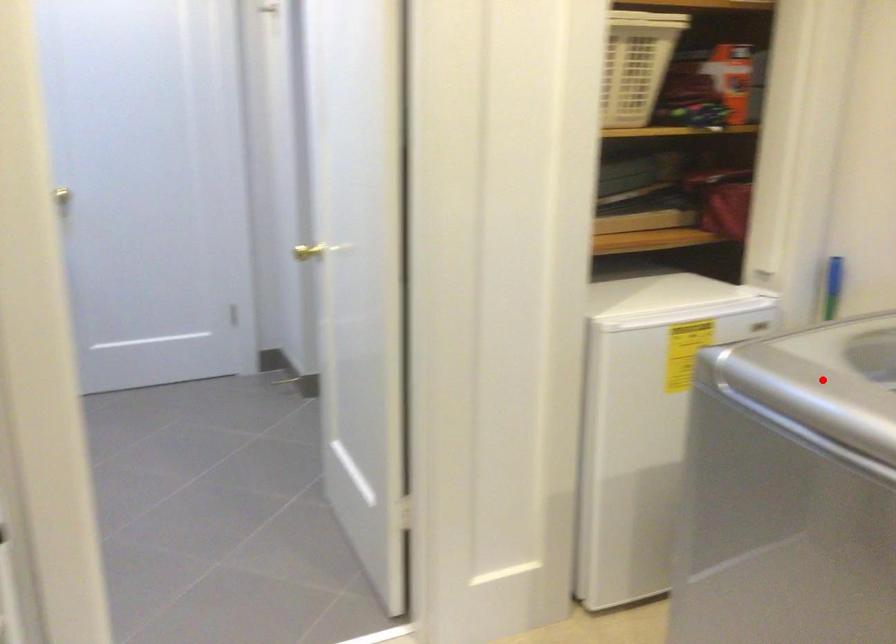
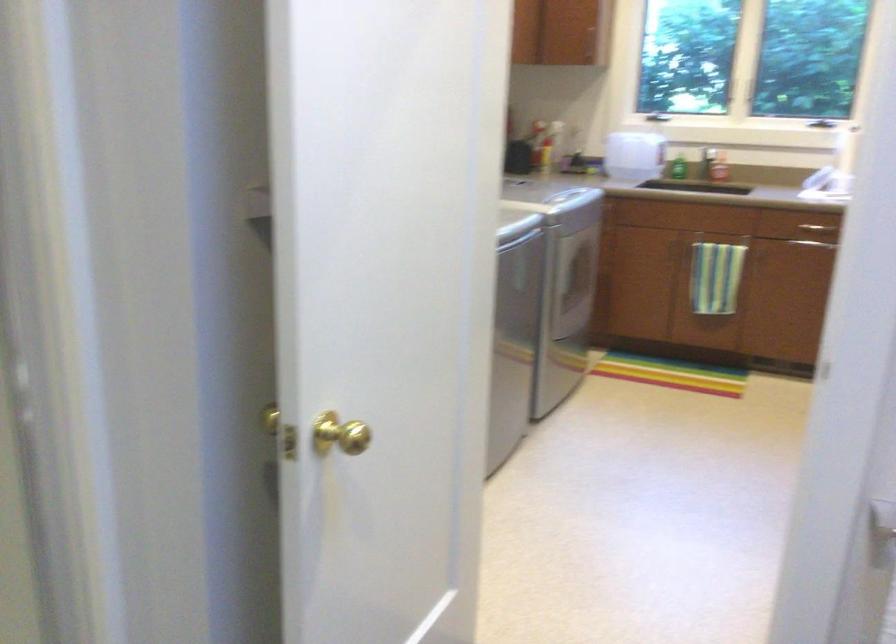
Question: I am providing you with two images of the same scene from different viewpoints. A red point is marked on the first image. Can you still see the location of the red point in image 2?

Choices:
 (A) Yes
 (B) No

Answer: (B)